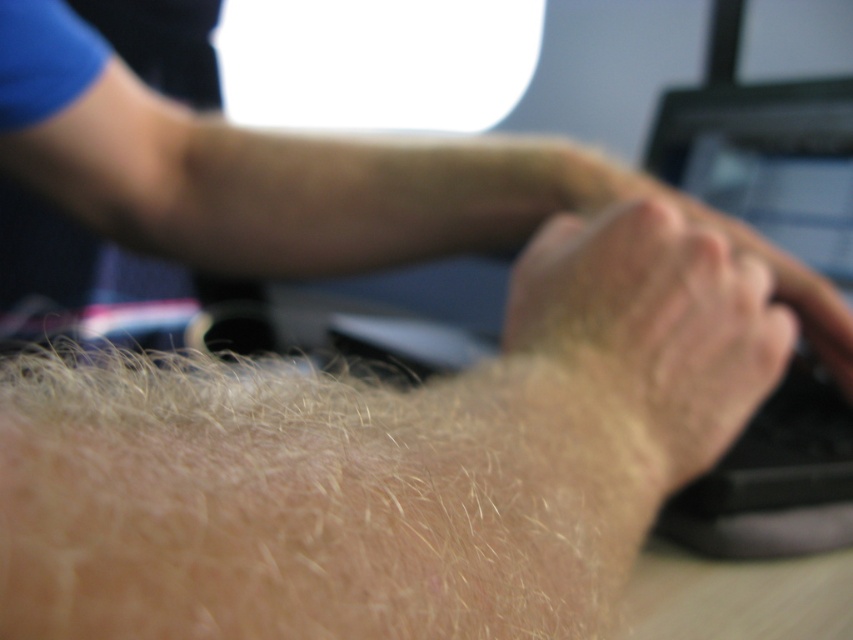
Is light brown coarse hair at lower left further to the viewer compared to black plastic keyboard at right?

No, it is in front of black plastic keyboard at right.

Who is shorter, light brown coarse hair at lower left or black plastic keyboard at right?

With less height is light brown coarse hair at lower left.

Who is more distant from viewer, (541, 426) or (796, 358)?

The point (796, 358) is more distant.

Locate an element on the screen. light brown coarse hair at lower left is located at coordinates (314, 502).

Does black plastic keyboard at right appear on the right side of matte black monitor at center?

Incorrect, black plastic keyboard at right is not on the right side of matte black monitor at center.

Who is taller, black plastic keyboard at right or matte black monitor at center?

black plastic keyboard at right is taller.

Who is more forward, (734, 212) or (791, 172)?

Point (791, 172) is more forward.

What are the coordinates of `black plastic keyboard at right` in the screenshot? It's located at (767, 161).

Is dry skin at center further to the viewer compared to black plastic keyboard at right?

No, dry skin at center is closer to the viewer.

Can you confirm if dry skin at center is wider than black plastic keyboard at right?

Yes, dry skin at center is wider than black plastic keyboard at right.

Where is `dry skin at center`? dry skin at center is located at coordinates (643, 340).

Find the location of a particular element. This screenshot has height=640, width=853. dry skin at center is located at coordinates (643, 340).